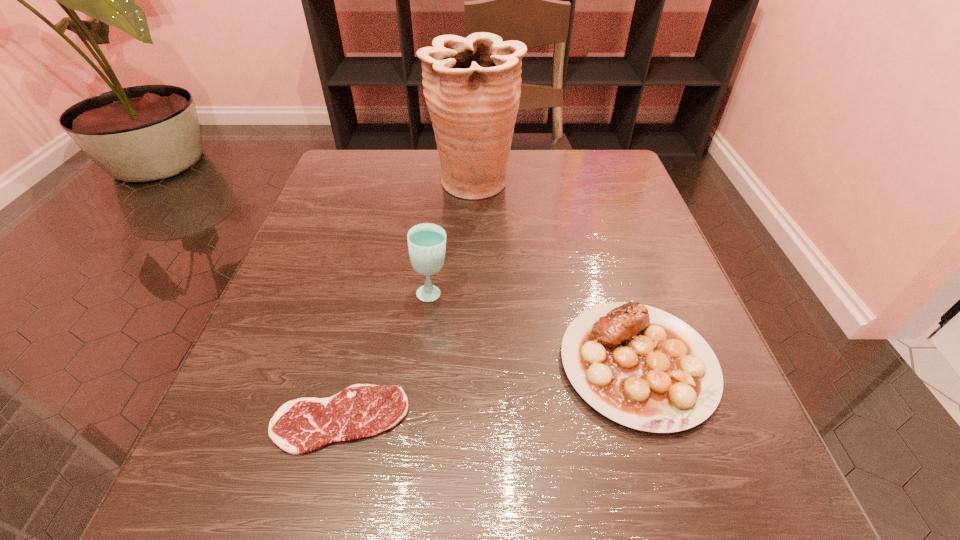
Locate an element on the screen. Image resolution: width=960 pixels, height=540 pixels. urn is located at coordinates (472, 86).

Identify the location of the farthest object. (472, 86).

Where is `the second tallest object`? the second tallest object is located at coordinates (426, 242).

The image size is (960, 540). I want to click on glass, so click(x=426, y=242).

Where is `the right steak`? This screenshot has height=540, width=960. the right steak is located at coordinates (642, 367).

Where is `the taller steak`? the taller steak is located at coordinates (642, 367).

What are the coordinates of `the shortest object` in the screenshot? It's located at (299, 426).

Locate an element on the screen. This screenshot has height=540, width=960. the shorter steak is located at coordinates (299, 426).

The image size is (960, 540). Find the location of `free region located on the right of the urn`. free region located on the right of the urn is located at coordinates (584, 183).

This screenshot has width=960, height=540. What are the coordinates of `vacant area situated on the back of the glass` in the screenshot? It's located at (442, 212).